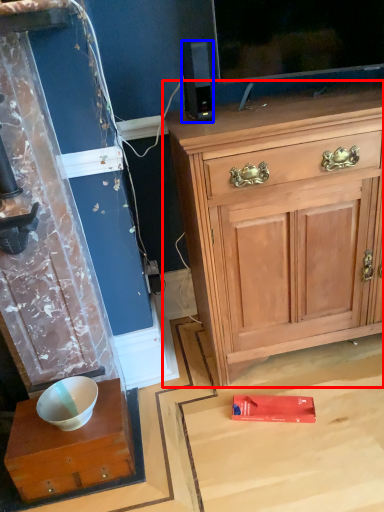
Question: Which of the following is the closest to the observer, cabinetry (highlighted by a red box) or loudspeaker (highlighted by a blue box)?

Choices:
 (A) cabinetry
 (B) loudspeaker

Answer: (A)